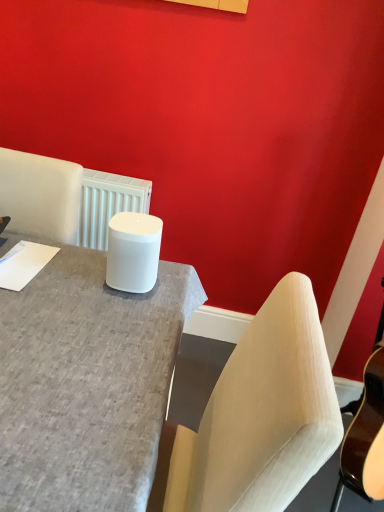
Question: Looking at their shapes, would you say matte gray desk at center is wider or thinner than white matte cylinder at center?

Choices:
 (A) thin
 (B) wide

Answer: (B)

Question: Visually, is matte gray desk at center positioned to the left or to the right of white matte cylinder at center?

Choices:
 (A) left
 (B) right

Answer: (B)

Question: Is matte gray desk at center inside or outside of white matte cylinder at center?

Choices:
 (A) outside
 (B) inside

Answer: (A)

Question: From the image's perspective, is white matte cylinder at center located above or below matte gray desk at center?

Choices:
 (A) above
 (B) below

Answer: (A)

Question: From a real-world perspective, relative to matte gray desk at center, is white matte cylinder at center vertically above or below?

Choices:
 (A) above
 (B) below

Answer: (A)

Question: Considering their positions, is white matte cylinder at center located in front of or behind matte gray desk at center?

Choices:
 (A) front
 (B) behind

Answer: (B)

Question: Based on their positions, is white matte cylinder at center located to the left or right of matte gray desk at center?

Choices:
 (A) left
 (B) right

Answer: (A)